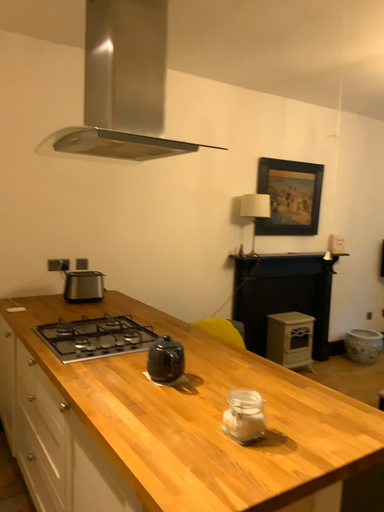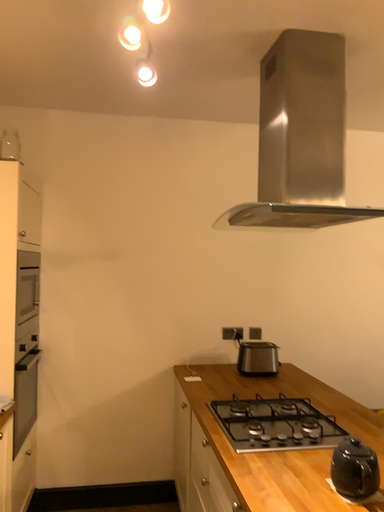
Question: How did the camera likely rotate when shooting the video?

Choices:
 (A) rotated left
 (B) rotated right

Answer: (A)